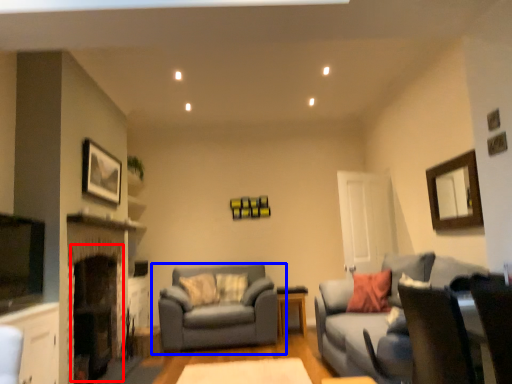
Question: Which object appears closest to the camera in this image, fireplace (highlighted by a red box) or studio couch (highlighted by a blue box)?

Choices:
 (A) fireplace
 (B) studio couch

Answer: (A)